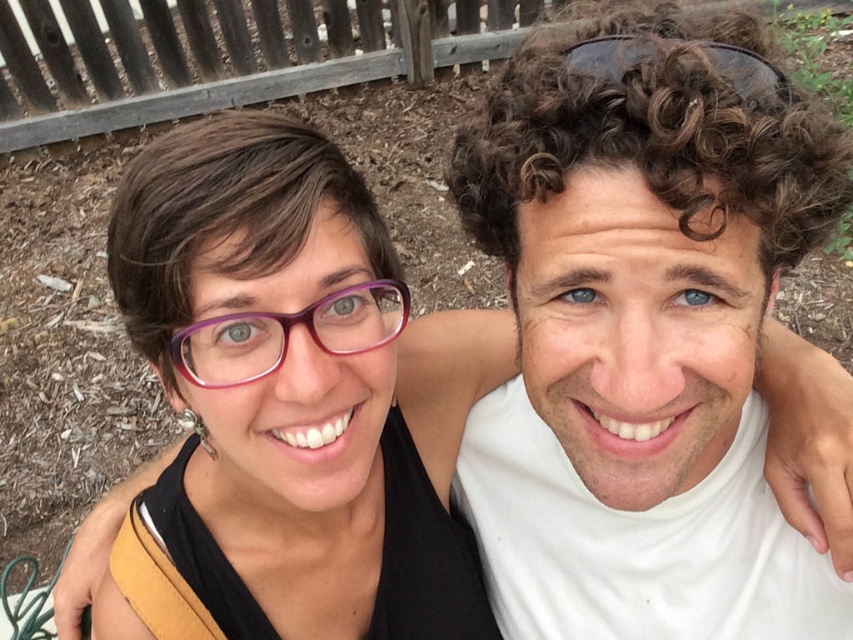
You are a photographer trying to capture a closeup of the purple acetate glasses at center and the sunglasses at upper center. Since you want to focus on both objects, which one should you adjust your camera to prioritize focusing on first?

The purple acetate glasses at center should be prioritized for focusing first since it is located below the sunglasses at upper center, meaning it is closer to the camera. By focusing on the closer object first, you can ensure both are in the frame and properly captured.

You are a photographer aiming to capture the purple acetate glasses at center in a closeup shot. The camera you are using has a focal length of 50mm. To ensure the glasses fill the frame adequately, you need to position yourself at a specific distance. Based on the glasses being at coordinates point 0.522, 0.339, can you determine if the glasses will be in the center of the frame?

The purple acetate glasses at center are located at point [288,333], which is the center of the frame, so yes, the glasses will be in the center of the frame.